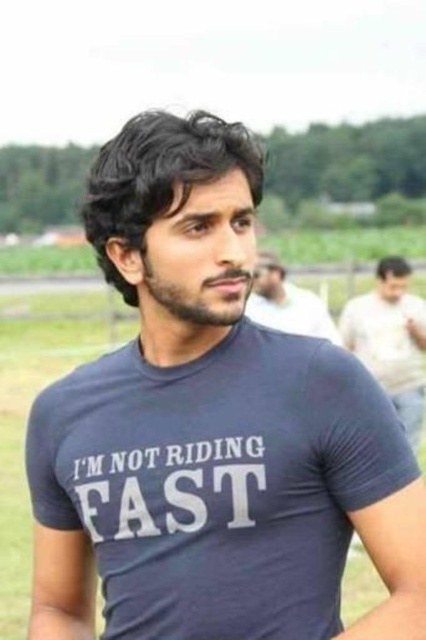
You are a photographer trying to capture the light beige shirt at right in the image. The camera focuses on the point at coordinates point (391, 339). Is the light beige shirt at right in focus?

Yes, the point (391, 339) corresponds to the light beige shirt at right, so it is in focus.